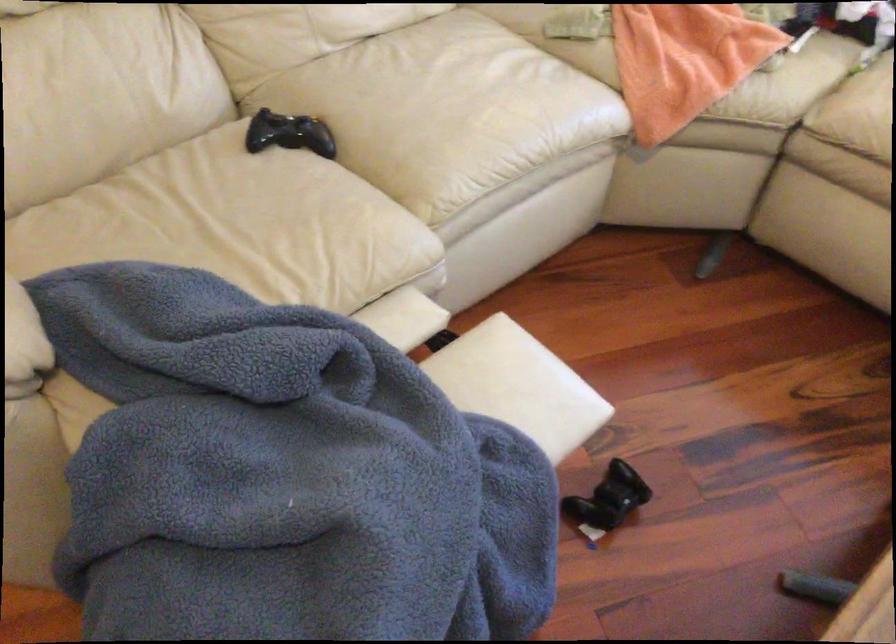
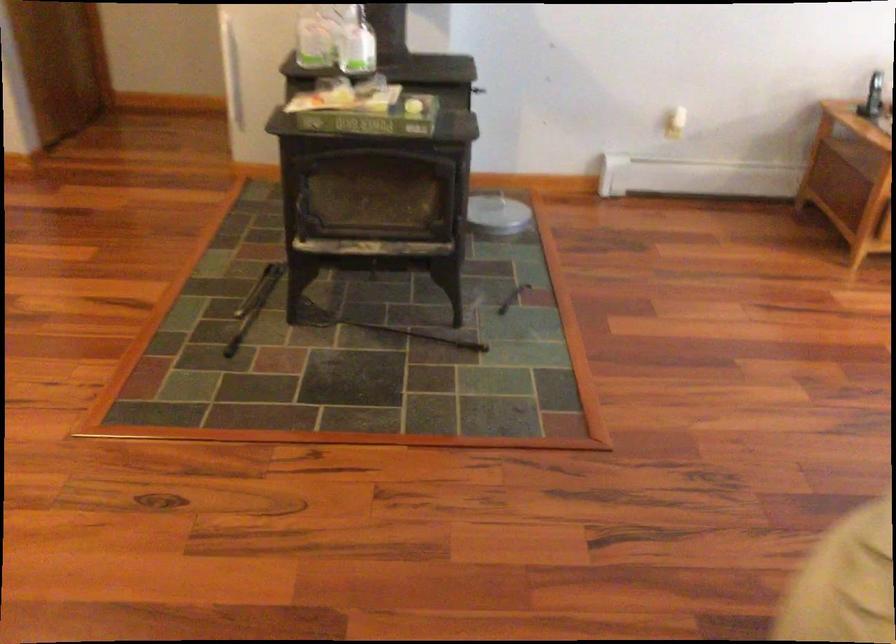
Question: Which direction would the cameraman need to move to produce the second image? Reply with the corresponding letter.

Choices:
 (A) Left
 (B) Right
 (C) Forward
 (D) Backward

Answer: (A)